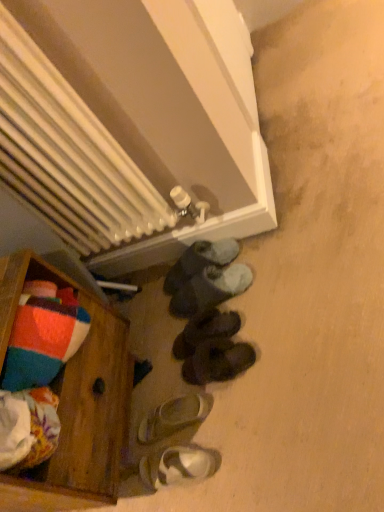
Find the location of a particular element. This screenshot has height=512, width=384. vacant space that is in between white matte sandal at lower center, which is the fifth footwear from top to bottom, and black suede shoes at lower center, which is the 4th footwear in top-to-bottom order is located at coordinates (193, 389).